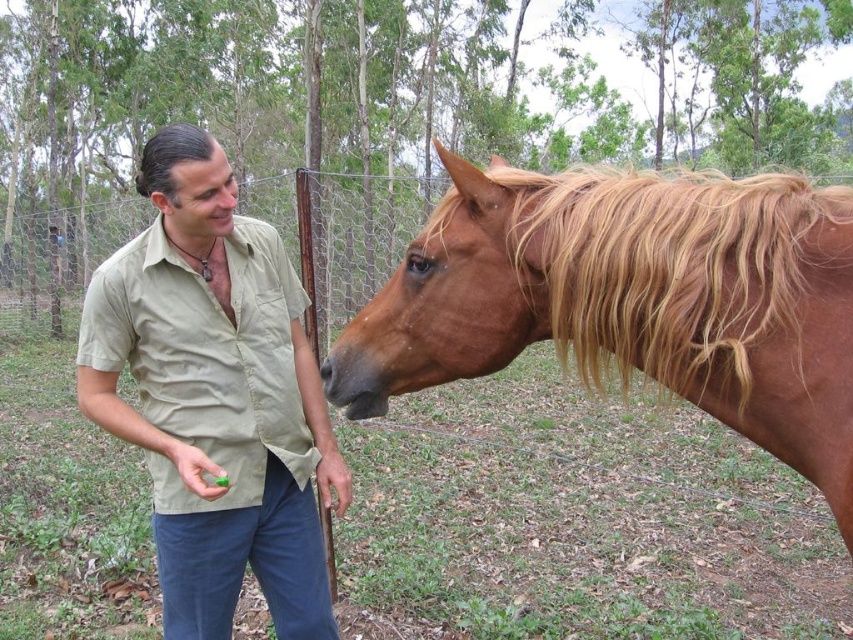
Who is more distant from viewer, [593,202] or [692,316]?

Positioned behind is point [593,202].

Is point (590, 376) in front of point (744, 372)?

That is False.

Is point (846, 348) more distant than point (640, 321)?

No, (846, 348) is closer to viewer.

Where is `brown glossy horse at right`? Image resolution: width=853 pixels, height=640 pixels. brown glossy horse at right is located at coordinates (630, 300).

Is matte khaki shirt at center to the right of golden silky mane at upper right from the viewer's perspective?

No, matte khaki shirt at center is not to the right of golden silky mane at upper right.

Is point (196, 214) closer to camera compared to point (705, 291)?

No, it is not.

You are a GUI agent. You are given a task and a screenshot of the screen. Output one action in this format:
    pyautogui.click(x=<x>, y=<y>)
    Task: Click on the matte khaki shirt at center
    This screenshot has width=853, height=640.
    Given the screenshot: What is the action you would take?
    pyautogui.click(x=215, y=396)

At what (x,y) coordinates should I click in order to perform the action: click on matte khaki shirt at center. Please return your answer as a coordinate pair (x, y). The height and width of the screenshot is (640, 853). Looking at the image, I should click on (215, 396).

Consider the image. Can you confirm if brown glossy horse at right is wider than matte khaki shirt at center?

Indeed, brown glossy horse at right has a greater width compared to matte khaki shirt at center.

Describe the element at coordinates (630, 300) in the screenshot. I see `brown glossy horse at right` at that location.

The width and height of the screenshot is (853, 640). In order to click on brown glossy horse at right in this screenshot , I will do `click(630, 300)`.